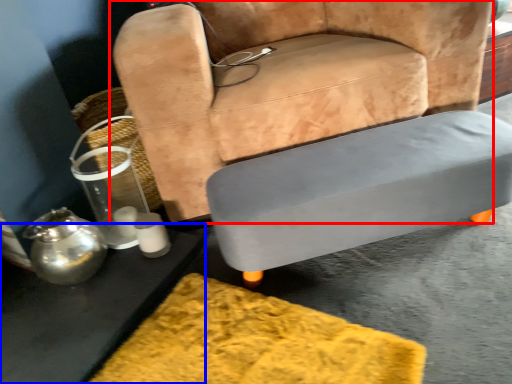
Question: Which object appears farthest to the camera in this image, chair (highlighted by a red box) or table (highlighted by a blue box)?

Choices:
 (A) chair
 (B) table

Answer: (A)